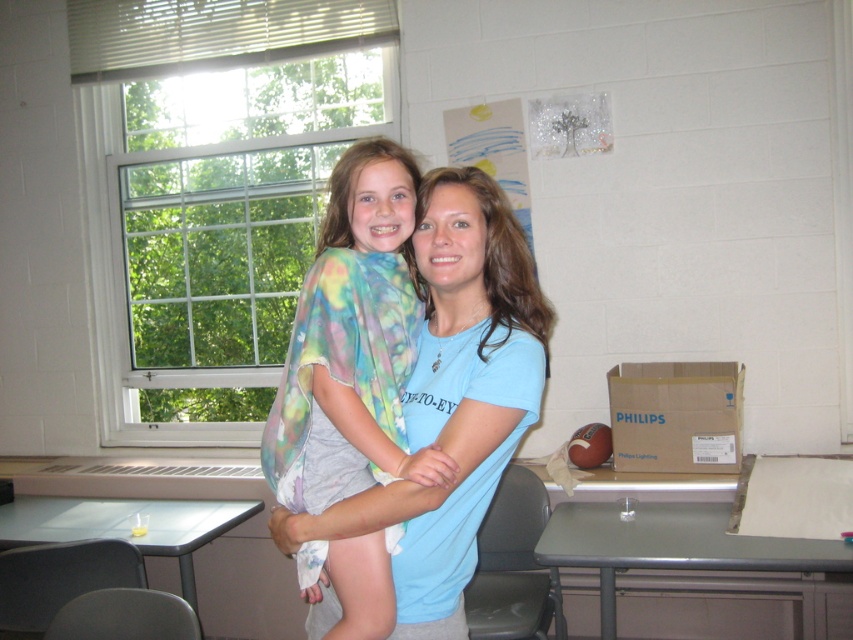
Which is more to the left, metallic gray table at lower right or gray plastic table at lower left?

Positioned to the left is gray plastic table at lower left.

Is metallic gray table at lower right closer to the viewer compared to gray plastic table at lower left?

Yes, it is.

Which is in front, point (723, 529) or point (108, 500)?

Positioned in front is point (723, 529).

This screenshot has width=853, height=640. In order to click on metallic gray table at lower right in this screenshot , I will do click(669, 545).

Is point (363, 296) more distant than point (793, 545)?

That is False.

The image size is (853, 640). Identify the location of tie-dye fabric at center. (352, 342).

Who is positioned more to the left, tie-dye fabric at center or gray plastic table at lower left?

gray plastic table at lower left

Measure the distance between tie-dye fabric at center and gray plastic table at lower left.

4.62 feet

Identify the location of tie-dye fabric at center. This screenshot has width=853, height=640. (352, 342).